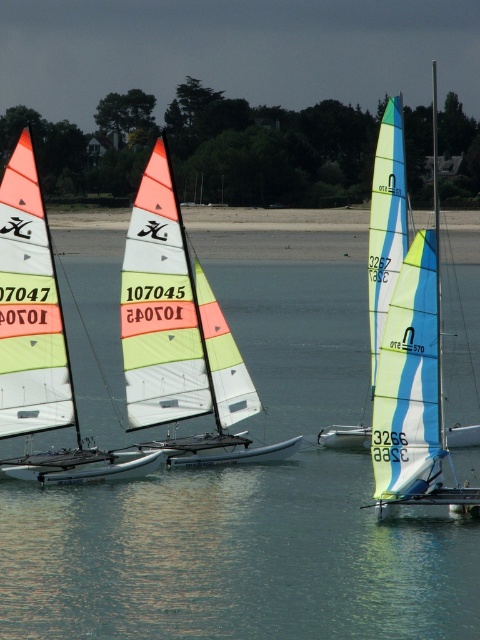
Question: Is light blue and white sail at right above light blue and white sail at center?

Choices:
 (A) yes
 (B) no

Answer: (B)

Question: Which of the following is the closest to the observer?

Choices:
 (A) (381, 314)
 (B) (391, 436)

Answer: (B)

Question: Estimate the real-world distances between objects in this image. Which object is farther from the light blue and white sail at center?

Choices:
 (A) matte white sailboat at center
 (B) light blue and white sail at right

Answer: (B)

Question: Which of the following is the farthest from the observer?

Choices:
 (A) light blue and white sail at center
 (B) matte white sailboat at center
 (C) light blue and white sail at right
 (D) transparent water at center

Answer: (A)

Question: Does matte white sailboat at center lie behind light blue and white sail at right?

Choices:
 (A) yes
 (B) no

Answer: (A)

Question: Can you confirm if transparent water at center is positioned above light blue and white sail at right?

Choices:
 (A) no
 (B) yes

Answer: (A)